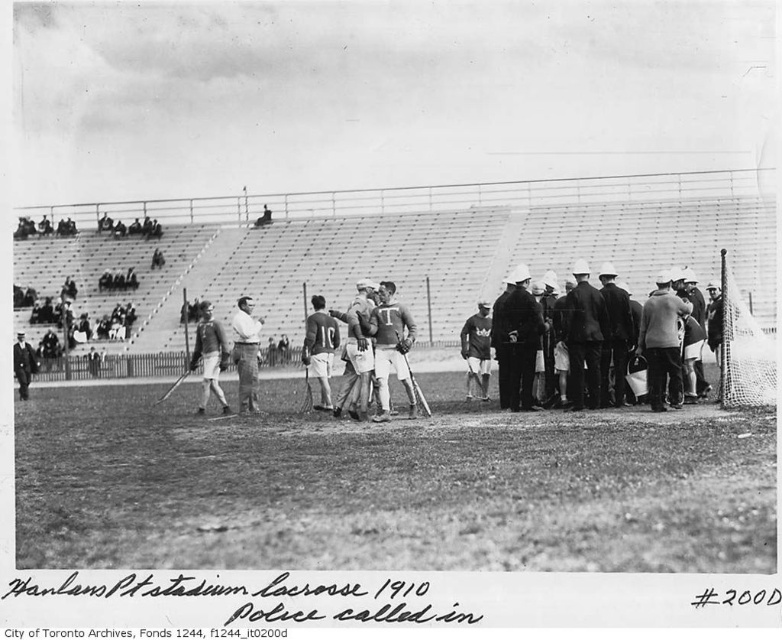
You are standing at the point marked as point (659, 352) in the image. The bleachers are behind you. If you walk straight ahead, will you reach the goalpost before the fence?

The distance from the point (659, 352) to the goalpost is shorter than to the fence, so yes, you will reach the goalpost before the fence.

You are a photographer analyzing the image of Hanlan s Point Stadium s 1910 lacrosse game. You notice two garments at the center of the image, the smooth leather jacket at center and the coarse wool sweater at center. Which garment appears closer to you?

The smooth leather jacket at center is closer to the viewer than the coarse wool sweater at center.